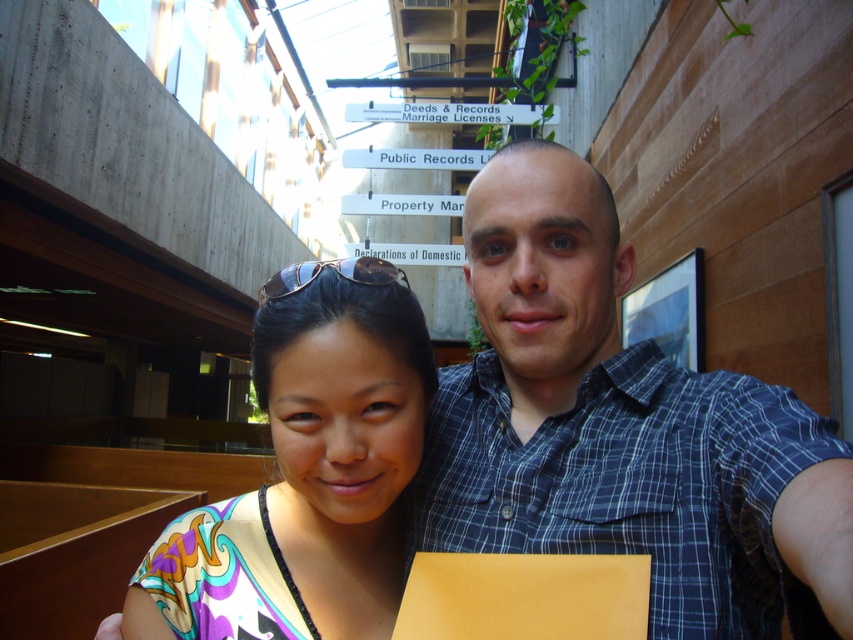
Question: Among these objects, which one is farthest from the camera?

Choices:
 (A) black plastic sunglasses at upper center
 (B) blue plaid shirt at center
 (C) multicolored fabric at center

Answer: (A)

Question: Among these points, which one is farthest from the camera?

Choices:
 (A) (560, 452)
 (B) (381, 525)
 (C) (270, 276)

Answer: (C)

Question: Does blue plaid shirt at center have a greater width compared to multicolored fabric at center?

Choices:
 (A) yes
 (B) no

Answer: (A)

Question: Which of the following is the closest to the observer?

Choices:
 (A) (279, 291)
 (B) (730, 564)
 (C) (175, 557)

Answer: (A)

Question: Is blue plaid shirt at center positioned at the back of black plastic sunglasses at upper center?

Choices:
 (A) no
 (B) yes

Answer: (A)

Question: Does multicolored fabric at center appear over black plastic sunglasses at upper center?

Choices:
 (A) yes
 (B) no

Answer: (B)